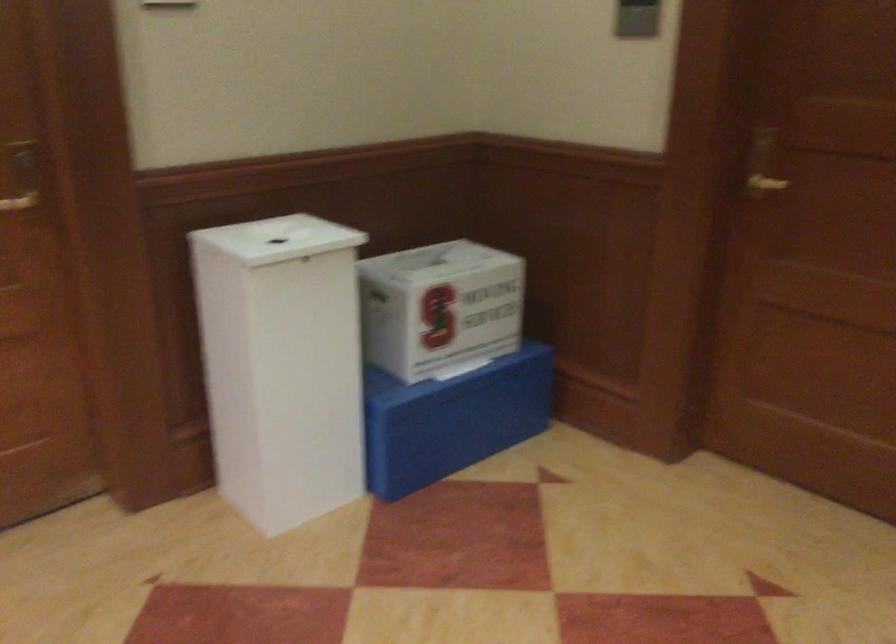
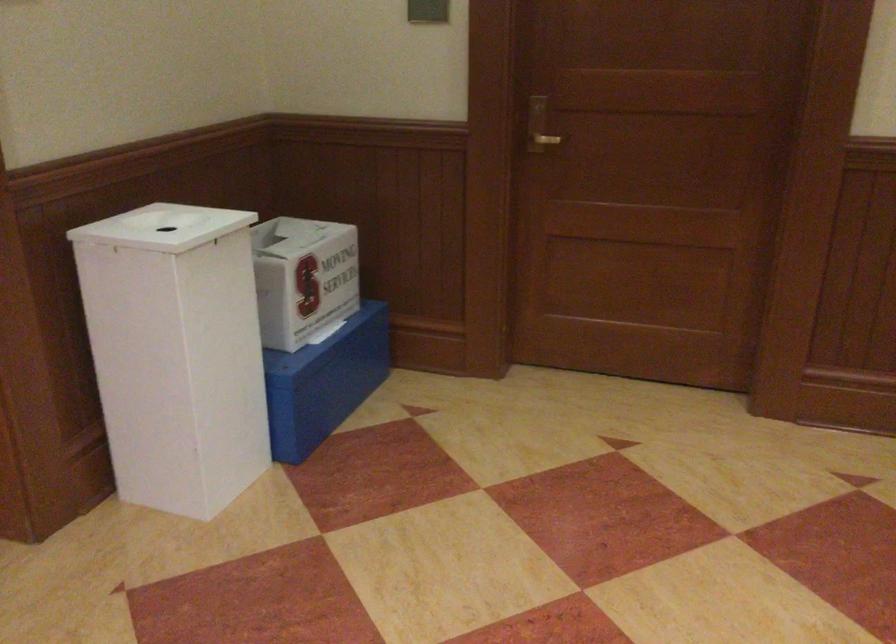
Where in the second image is the point corresponding to [755,171] from the first image?

(538, 126)